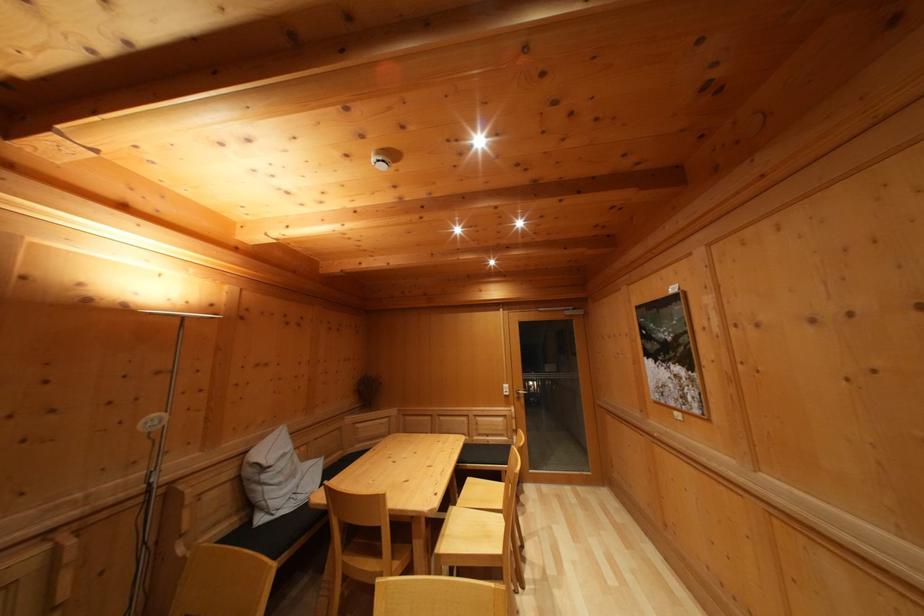
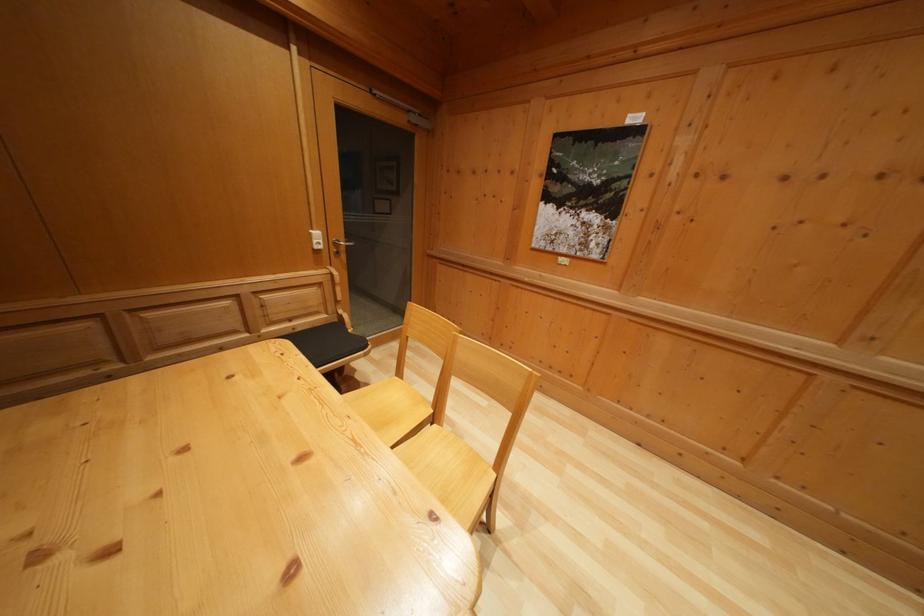
The point at (x=512, y=392) is marked in the first image. Where is the corresponding point in the second image?

(322, 240)